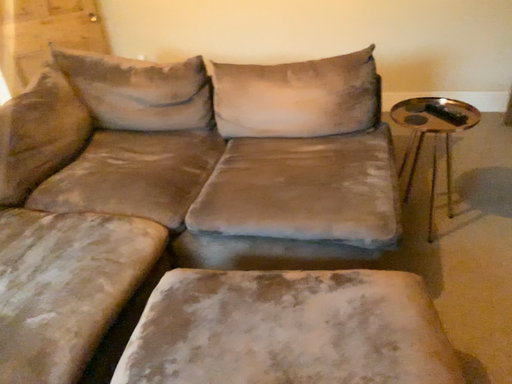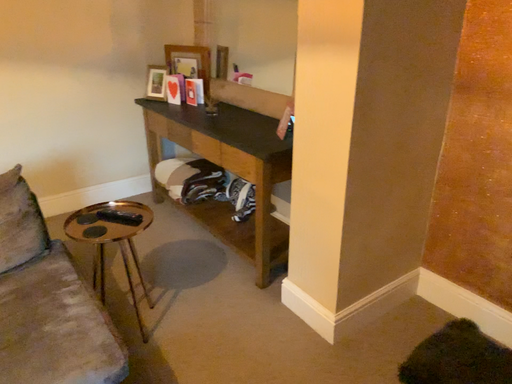
Question: How did the camera likely rotate when shooting the video?

Choices:
 (A) rotated downward
 (B) rotated upward

Answer: (B)